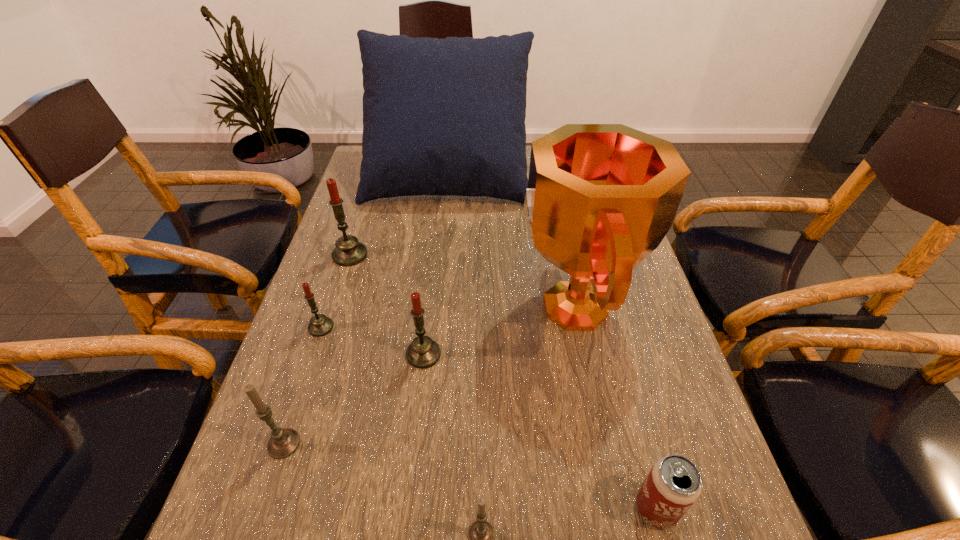
Find the location of a particular element. red beer can is located at coordinates (673, 484).

This screenshot has width=960, height=540. What are the coordinates of `vacant region located 0.310m on the facing side of the cushion` in the screenshot? It's located at (437, 285).

You are a GUI agent. You are given a task and a screenshot of the screen. Output one action in this format:
    pyautogui.click(x=<x>, y=<y>)
    Task: Click on the free space located on the side of the gold award with the star emblem
    
    Given the screenshot: What is the action you would take?
    pyautogui.click(x=405, y=307)

Identify the location of vacant area situated on the side of the gold award with the star emblem. (476, 307).

Locate an element on the screen. This screenshot has height=540, width=960. free space located on the side of the gold award with the star emblem is located at coordinates (463, 307).

Where is `free space located on the back of the tallest candle`? Image resolution: width=960 pixels, height=540 pixels. free space located on the back of the tallest candle is located at coordinates (369, 197).

Where is `vacant area situated on the back of the third nearest candle`? The width and height of the screenshot is (960, 540). vacant area situated on the back of the third nearest candle is located at coordinates (432, 275).

This screenshot has height=540, width=960. In order to click on vacant space located 0.320m on the right of the bigger gray candle in this screenshot , I will do `click(484, 443)`.

Identify the location of vacant region located on the front of the second nearest red candle. (253, 530).

Where is `vacant area situated 0.280m on the back of the beer can`? Image resolution: width=960 pixels, height=540 pixels. vacant area situated 0.280m on the back of the beer can is located at coordinates (612, 347).